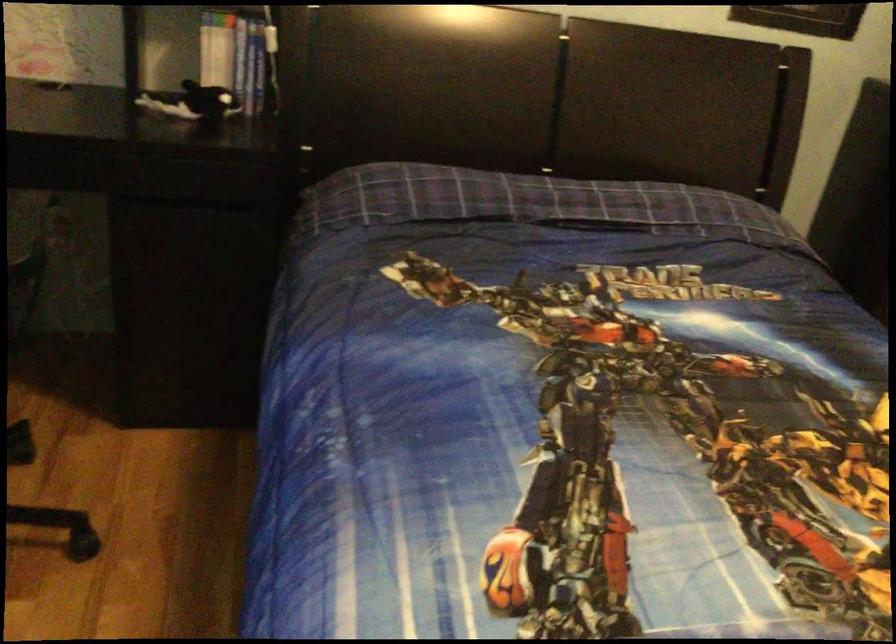
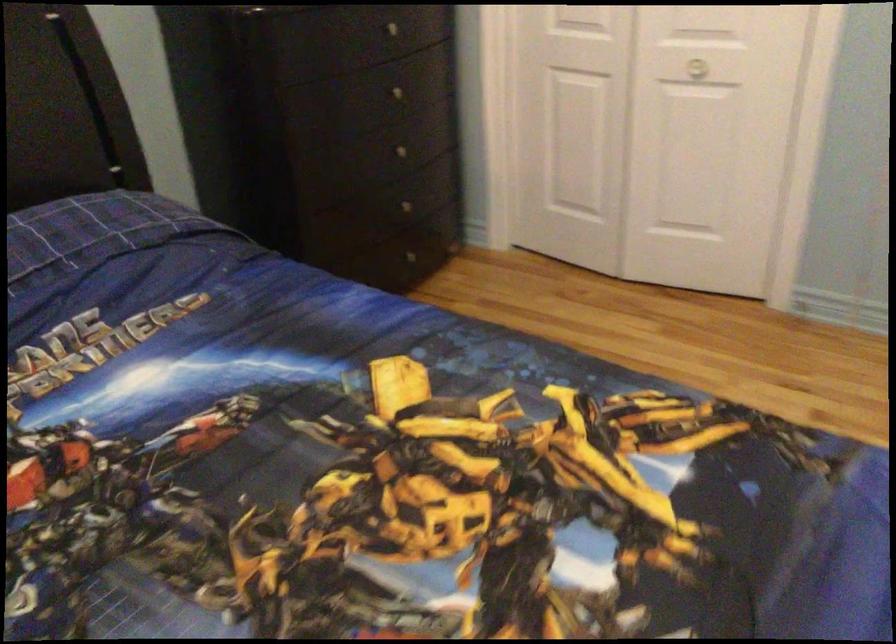
Question: How did the camera likely rotate?

Choices:
 (A) Left
 (B) Right
 (C) Up
 (D) Down

Answer: (B)